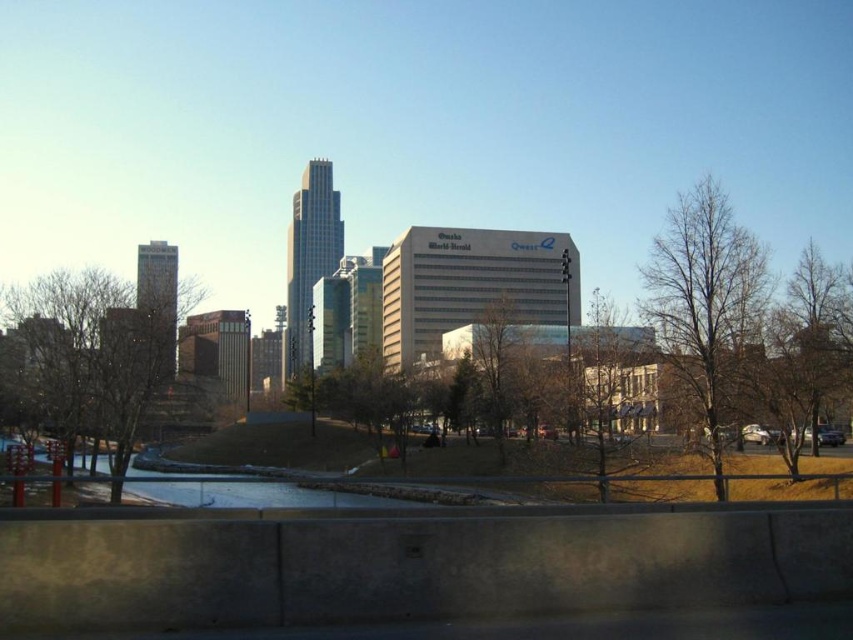
Does bare branches at left have a lesser height compared to bare wood tree at center?

In fact, bare branches at left may be taller than bare wood tree at center.

Does bare branches at left appear on the left side of bare wood tree at center?

Indeed, bare branches at left is positioned on the left side of bare wood tree at center.

Is point (45, 323) positioned behind point (653, 364)?

Yes, it is behind point (653, 364).

Where is `bare branches at left`? Image resolution: width=853 pixels, height=640 pixels. bare branches at left is located at coordinates (86, 356).

Who is lower down, bare wood tree at center or green leafy tree at center?

green leafy tree at center

Consider the image. Can you confirm if bare wood tree at center is positioned to the left of green leafy tree at center?

In fact, bare wood tree at center is to the right of green leafy tree at center.

Is point (601, 348) behind point (502, 426)?

No, it is in front of (502, 426).

Identify the location of bare wood tree at center. This screenshot has height=640, width=853. (607, 372).

Is point (679, 243) farther from viewer compared to point (486, 352)?

No, (679, 243) is closer to viewer.

Can you confirm if bare branches at right is shorter than green leafy tree at center?

No, bare branches at right is not shorter than green leafy tree at center.

Which is in front, point (730, 312) or point (479, 324)?

Positioned in front is point (730, 312).

You are a GUI agent. You are given a task and a screenshot of the screen. Output one action in this format:
    pyautogui.click(x=<x>, y=<y>)
    Task: Click on the bare branches at right
    
    Given the screenshot: What is the action you would take?
    pyautogui.click(x=705, y=301)